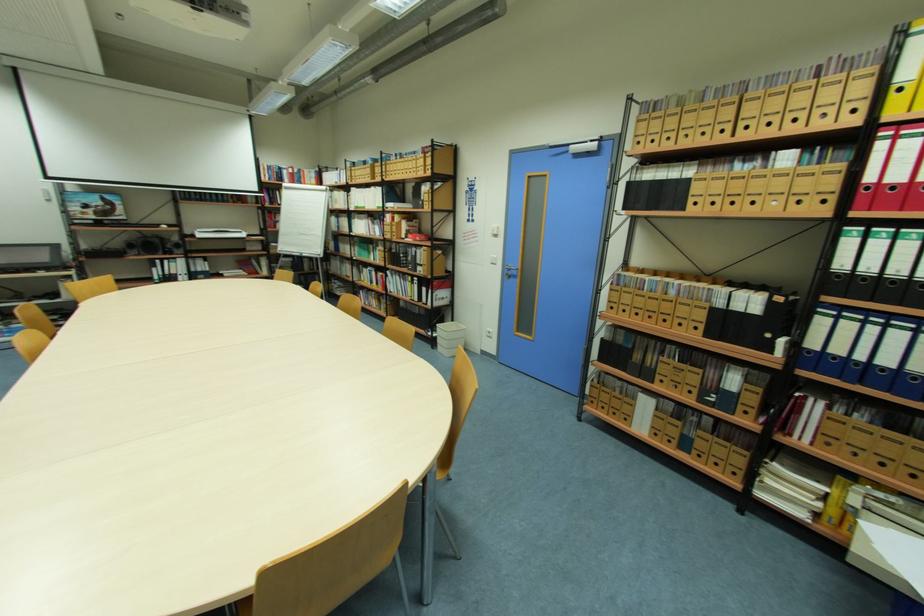
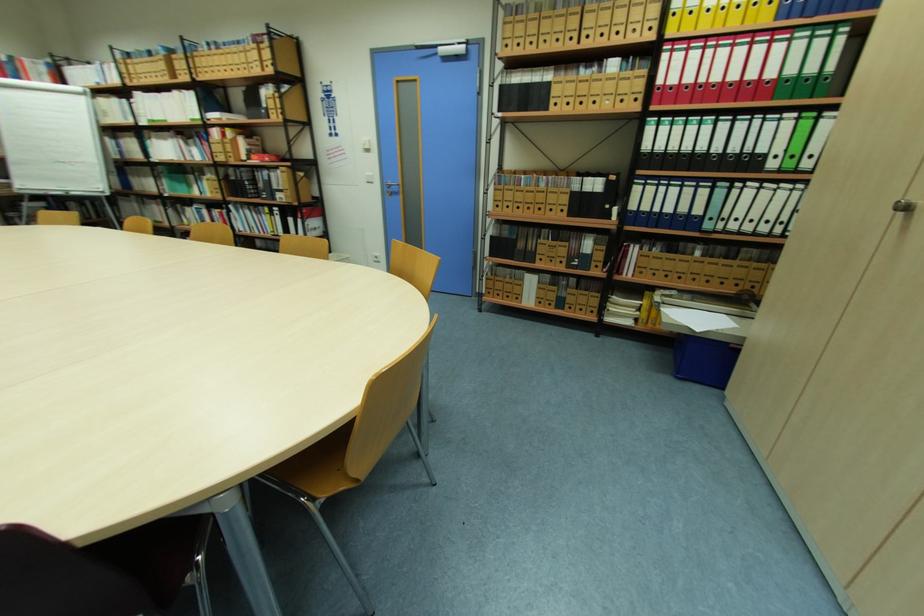
Question: The camera is either moving clockwise (left) or counter-clockwise (right) around the object. The first image is from the beginning of the video and the second image is from the end. Is the camera moving left or right when shooting the video?

Choices:
 (A) Left
 (B) Right

Answer: (A)